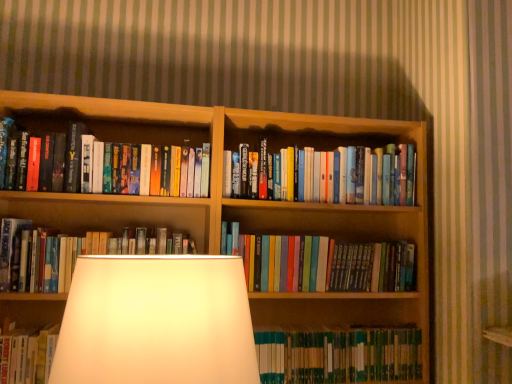
Measure the distance between hardcover books at center, positioned as the third book in bottom-to-top order, and camera.

hardcover books at center, positioned as the third book in bottom-to-top order, is 4.40 feet away from camera.

Locate an element on the screen. This screenshot has width=512, height=384. hardcover books at center, positioned as the third book in bottom-to-top order is located at coordinates (73, 254).

Image resolution: width=512 pixels, height=384 pixels. What do you see at coordinates (339, 356) in the screenshot?
I see `green hardcover book at center, acting as the fifth book starting from the top` at bounding box center [339, 356].

Locate an element on the screen. wooden bookcase at center is located at coordinates (240, 199).

Locate an element on the screen. hardcover books at center, positioned as the third book in bottom-to-top order is located at coordinates (73, 254).

Is hardcover books at center, positioned as the third book in bottom-to-top order, turned away from hardcover books at center, which is counted as the second book, starting from the top?

That's not correct — hardcover books at center, positioned as the third book in bottom-to-top order, is not looking away from hardcover books at center, which is counted as the second book, starting from the top.

Is the position of hardcover books at center, which ranks as the third book in top-to-bottom order, less distant than that of hardcover books at center, positioned as the fourth book in bottom-to-top order?

Yes, it is in front of hardcover books at center, positioned as the fourth book in bottom-to-top order.

From the image's perspective, starting from the hardcover books at center, which ranks as the third book in top-to-bottom order, which book is the 1st one above? Please provide its 2D coordinates.

[(346, 175)]

Is hardcover books at center, positioned as the third book in bottom-to-top order, wider or thinner than hardcover books at center, positioned as the fourth book in bottom-to-top order?

In the image, hardcover books at center, positioned as the third book in bottom-to-top order, appears to be wider than hardcover books at center, positioned as the fourth book in bottom-to-top order.

Looking at their sizes, would you say green hardcover book at center, acting as the fifth book starting from the top, is wider or thinner than hardcover books at center, the 4th book viewed from the top?

Considering their sizes, green hardcover book at center, acting as the fifth book starting from the top, looks broader than hardcover books at center, the 4th book viewed from the top.

Which is nearer, (288, 342) or (379, 274)?

Point (288, 342) is positioned closer to the camera compared to point (379, 274).

Does green hardcover book at center, acting as the fifth book starting from the top, have a larger size compared to hardcover books at center, the 2th book positioned from the bottom?

Incorrect, green hardcover book at center, acting as the fifth book starting from the top, is not larger than hardcover books at center, the 2th book positioned from the bottom.

In the scene shown: Are green hardcover book at center, the 1th book ordered from the bottom, and hardcover books at center, the 2th book positioned from the bottom, far apart?

No.

From the image's perspective, is hardcover books at center, the 2th book positioned from the bottom, over wooden bookcase at center?

No, from the image's perspective, hardcover books at center, the 2th book positioned from the bottom, is not on top of wooden bookcase at center.

From the image's perspective, count 1st books downward from the wooden bookcase at center and point to it. Please provide its 2D coordinates.

[(321, 263)]

How many degrees apart are the facing directions of hardcover books at center, the 2th book positioned from the bottom, and wooden bookcase at center?

There is a 0.0354-degree angle between the facing directions of hardcover books at center, the 2th book positioned from the bottom, and wooden bookcase at center.

Is hardcover books at center, the 2th book positioned from the bottom, taller or shorter than wooden bookcase at center?

Considering their sizes, hardcover books at center, the 2th book positioned from the bottom, has less height than wooden bookcase at center.

Who is bigger, hardcover books at center, positioned as the fourth book in bottom-to-top order, or hardcover books at center, the 4th book viewed from the top?

With larger size is hardcover books at center, the 4th book viewed from the top.

Is the position of hardcover books at center, which is counted as the second book, starting from the top, more distant than that of hardcover books at center, the 2th book positioned from the bottom?

Yes, hardcover books at center, which is counted as the second book, starting from the top, is further from the viewer.

Is hardcover books at center, positioned as the fourth book in bottom-to-top order, located outside hardcover books at center, the 4th book viewed from the top?

Yes, hardcover books at center, positioned as the fourth book in bottom-to-top order, is outside of hardcover books at center, the 4th book viewed from the top.

Is wooden bookcase at center to the left or to the right of hardcover books at center, positioned as the third book in bottom-to-top order, in the image?

From the image, it's evident that wooden bookcase at center is to the right of hardcover books at center, positioned as the third book in bottom-to-top order.

In terms of size, does wooden bookcase at center appear bigger or smaller than hardcover books at center, positioned as the third book in bottom-to-top order?

wooden bookcase at center is bigger than hardcover books at center, positioned as the third book in bottom-to-top order.

Looking at their sizes, would you say wooden bookcase at center is wider or thinner than hardcover books at center, positioned as the third book in bottom-to-top order?

In the image, wooden bookcase at center appears to be wider than hardcover books at center, positioned as the third book in bottom-to-top order.

Is point (408, 199) positioned in front of point (104, 189)?

No, it is behind (104, 189).

Is hardcover books at center, which is counted as the second book, starting from the top, bigger than hardcover books at left, the first book when ordered from top to bottom?

No.

Between hardcover books at center, positioned as the fourth book in bottom-to-top order, and hardcover books at left, the first book when ordered from top to bottom, which one has more height?

hardcover books at left, the first book when ordered from top to bottom, is taller.

From the image's perspective, which is below, hardcover books at center, positioned as the fourth book in bottom-to-top order, or hardcover books at left, the first book when ordered from top to bottom?

hardcover books at center, positioned as the fourth book in bottom-to-top order.

In the scene shown: Is green hardcover book at center, acting as the fifth book starting from the top, inside the boundaries of hardcover books at center, which ranks as the third book in top-to-bottom order, or outside?

green hardcover book at center, acting as the fifth book starting from the top, is located beyond the bounds of hardcover books at center, which ranks as the third book in top-to-bottom order.

Is green hardcover book at center, acting as the fifth book starting from the top, far from hardcover books at center, which ranks as the third book in top-to-bottom order?

No, there isn't a large distance between green hardcover book at center, acting as the fifth book starting from the top, and hardcover books at center, which ranks as the third book in top-to-bottom order.

Considering the relative positions of green hardcover book at center, acting as the fifth book starting from the top, and hardcover books at center, which ranks as the third book in top-to-bottom order, in the image provided, is green hardcover book at center, acting as the fifth book starting from the top, to the left of hardcover books at center, which ranks as the third book in top-to-bottom order, from the viewer's perspective?

In fact, green hardcover book at center, acting as the fifth book starting from the top, is to the right of hardcover books at center, which ranks as the third book in top-to-bottom order.

Considering the points (341, 378) and (61, 258), which point is behind, point (341, 378) or point (61, 258)?

The point (341, 378) is farther from the camera.

From a real-world perspective, starting from the hardcover books at center, positioned as the fourth book in bottom-to-top order, which book is the 2nd one below it? Please provide its 2D coordinates.

[(73, 254)]

Where is `book that is the 2nd one above the green hardcover book at center, acting as the fifth book starting from the top (from a real-world perspective)`? Image resolution: width=512 pixels, height=384 pixels. book that is the 2nd one above the green hardcover book at center, acting as the fifth book starting from the top (from a real-world perspective) is located at coordinates (321, 263).

Based on the photo, based on their spatial positions, is hardcover books at center, which is counted as the second book, starting from the top, or hardcover books at center, which ranks as the third book in top-to-bottom order, further from hardcover books at center, the 4th book viewed from the top?

hardcover books at center, which ranks as the third book in top-to-bottom order, lies further to hardcover books at center, the 4th book viewed from the top, than the other object.

When comparing their distances from hardcover books at center, the 2th book positioned from the bottom, does wooden bookcase at center or hardcover books at center, which is counted as the second book, starting from the top, seem further?

Among the two, hardcover books at center, which is counted as the second book, starting from the top, is located further to hardcover books at center, the 2th book positioned from the bottom.

Considering their positions, is hardcover books at center, positioned as the third book in bottom-to-top order, positioned further to hardcover books at center, the 4th book viewed from the top, than hardcover books at center, which is counted as the second book, starting from the top?

hardcover books at center, positioned as the third book in bottom-to-top order.

Estimate the real-world distances between objects in this image. Which object is closer to hardcover books at left, marked as the fifth book in a bottom-to-top arrangement, hardcover books at center, which is counted as the second book, starting from the top, or hardcover books at center, the 4th book viewed from the top?

hardcover books at center, the 4th book viewed from the top, is positioned closer to the anchor hardcover books at left, marked as the fifth book in a bottom-to-top arrangement.

Which object lies nearer to the anchor point hardcover books at left, marked as the fifth book in a bottom-to-top arrangement, green hardcover book at center, acting as the fifth book starting from the top, or hardcover books at center, the 4th book viewed from the top?

hardcover books at center, the 4th book viewed from the top, lies closer to hardcover books at left, marked as the fifth book in a bottom-to-top arrangement, than the other object.

From the image, which object appears to be farther from green hardcover book at center, the 1th book ordered from the bottom, hardcover books at center, which ranks as the third book in top-to-bottom order, or hardcover books at center, positioned as the fourth book in bottom-to-top order?

hardcover books at center, which ranks as the third book in top-to-bottom order, is positioned further to the anchor green hardcover book at center, the 1th book ordered from the bottom.

Looking at this image, which object lies nearer to the anchor point hardcover books at center, positioned as the fourth book in bottom-to-top order, hardcover books at left, the first book when ordered from top to bottom, or hardcover books at center, the 2th book positioned from the bottom?

hardcover books at center, the 2th book positioned from the bottom, is positioned closer to the anchor hardcover books at center, positioned as the fourth book in bottom-to-top order.

When comparing their distances from hardcover books at center, positioned as the third book in bottom-to-top order, does green hardcover book at center, the 1th book ordered from the bottom, or wooden bookcase at center seem closer?

wooden bookcase at center lies closer to hardcover books at center, positioned as the third book in bottom-to-top order, than the other object.

Image resolution: width=512 pixels, height=384 pixels. I want to click on bookcase between hardcover books at left, marked as the fifth book in a bottom-to-top arrangement, and hardcover books at center, positioned as the fourth book in bottom-to-top order, in the horizontal direction, so click(x=240, y=199).

Locate an element on the screen. This screenshot has height=384, width=512. book located between hardcover books at left, the first book when ordered from top to bottom, and hardcover books at center, positioned as the fourth book in bottom-to-top order, in the left-right direction is located at coordinates (321, 263).

The height and width of the screenshot is (384, 512). In order to click on bookcase between hardcover books at center, which ranks as the third book in top-to-bottom order, and hardcover books at center, the 2th book positioned from the bottom in this screenshot , I will do `click(240, 199)`.

Locate an element on the screen. The image size is (512, 384). book located between wooden bookcase at center and hardcover books at center, which is counted as the second book, starting from the top, in the left-right direction is located at coordinates pos(321,263).